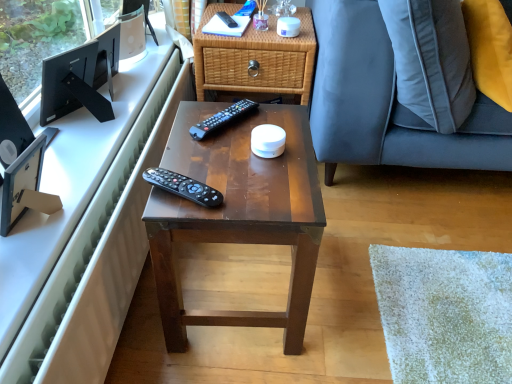
I want to click on vacant space in between black plastic remote control at center, the 1th remote control in the bottom-to-top sequence, and black plastic remote control at center, which appears as the second remote control when viewed from the front, so click(209, 155).